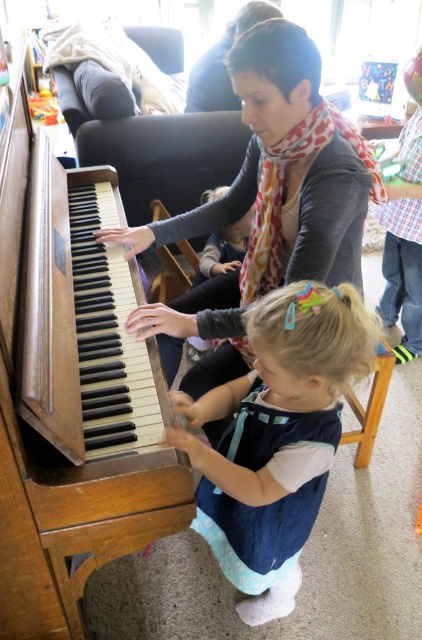
Question: Can you confirm if wooden piano at left is positioned below matte gray sweater at center?

Choices:
 (A) no
 (B) yes

Answer: (B)

Question: Is the position of denim dress at lower center more distant than that of light blue denim dress at center?

Choices:
 (A) no
 (B) yes

Answer: (A)

Question: Which point appears farthest from the camera in this image?

Choices:
 (A) (240, 506)
 (B) (253, 205)
 (C) (313, 128)

Answer: (B)

Question: Which of the following is the closest to the observer?

Choices:
 (A) matte gray sweater at center
 (B) denim dress at lower center
 (C) wooden piano at left

Answer: (C)

Question: Can you confirm if denim dress at lower center is bigger than wooden stool at lower center?

Choices:
 (A) yes
 (B) no

Answer: (A)

Question: Which point appears closest to the camera in this image?

Choices:
 (A) (364, 374)
 (B) (232, 253)

Answer: (A)